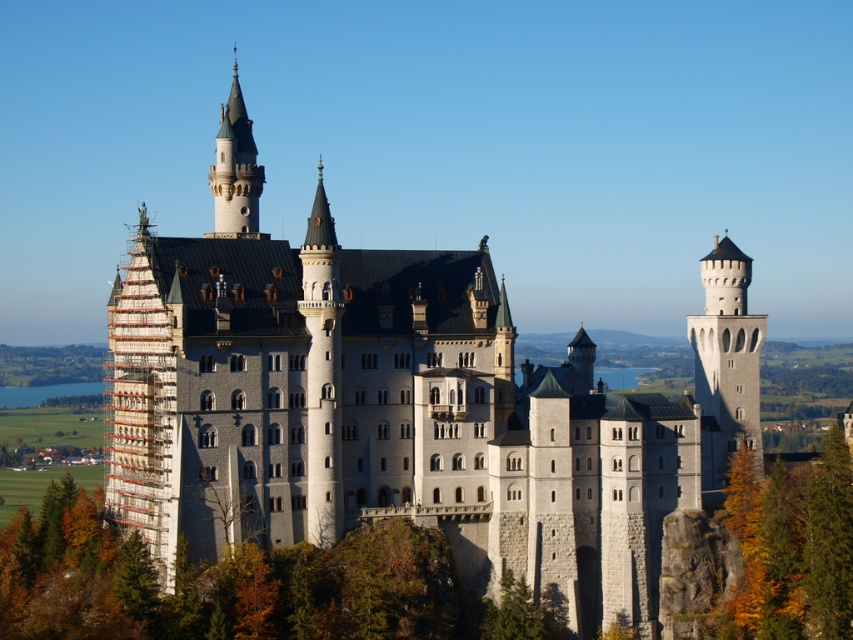
Between yellow-green leaves at right and smooth gray stone tower at upper left, which one appears on the left side from the viewer's perspective?

Positioned to the left is smooth gray stone tower at upper left.

Who is more forward, (821, 467) or (248, 234)?

Point (821, 467) is in front.

Does point (785, 484) come behind point (227, 140)?

No, it is in front of (227, 140).

The height and width of the screenshot is (640, 853). What are the coordinates of `yellow-green leaves at right` in the screenshot? It's located at (790, 548).

Does white stone castle at center appear on the right side of yellow-green leaves at right?

No, white stone castle at center is not to the right of yellow-green leaves at right.

Based on the photo, is white stone castle at center above yellow-green leaves at right?

Indeed, white stone castle at center is positioned over yellow-green leaves at right.

Is point (535, 461) closer to viewer compared to point (801, 634)?

No, (535, 461) is further to viewer.

Locate an element on the screen. The height and width of the screenshot is (640, 853). white stone castle at center is located at coordinates (407, 413).

Is white stone castle at center behind smooth gray stone tower at upper left?

No.

Can you confirm if white stone castle at center is positioned to the right of smooth gray stone tower at upper left?

Correct, you'll find white stone castle at center to the right of smooth gray stone tower at upper left.

At what (x,y) coordinates should I click in order to perform the action: click on white stone castle at center. Please return your answer as a coordinate pair (x, y). This screenshot has width=853, height=640. Looking at the image, I should click on [x=407, y=413].